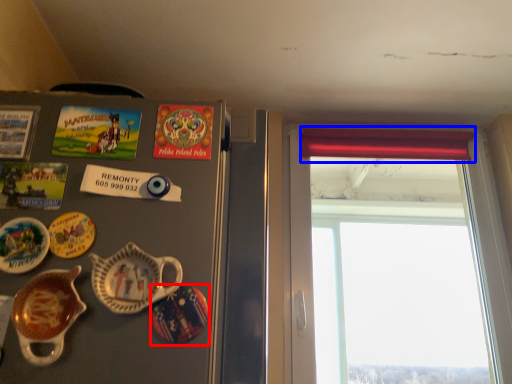
Question: Which object appears farthest to the camera in this image, plate (highlighted by a red box) or curtain (highlighted by a blue box)?

Choices:
 (A) plate
 (B) curtain

Answer: (B)